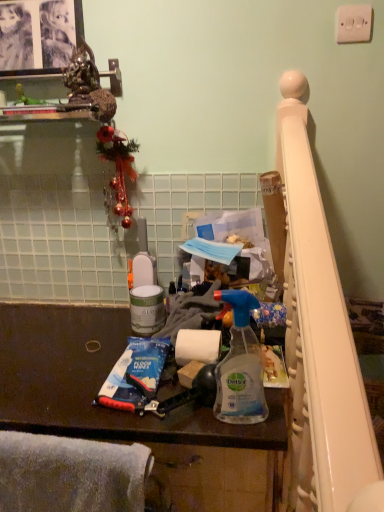
Question: Is white glossy paint can at center thinner than dark brown laminate counter at center?

Choices:
 (A) no
 (B) yes

Answer: (B)

Question: Is white glossy paint can at center not close to dark brown laminate counter at center?

Choices:
 (A) yes
 (B) no

Answer: (B)

Question: Does white glossy paint can at center have a greater height compared to dark brown laminate counter at center?

Choices:
 (A) yes
 (B) no

Answer: (B)

Question: Is white glossy paint can at center behind dark brown laminate counter at center?

Choices:
 (A) yes
 (B) no

Answer: (A)

Question: Considering the relative positions of white glossy paint can at center and dark brown laminate counter at center in the image provided, is white glossy paint can at center to the left of dark brown laminate counter at center from the viewer's perspective?

Choices:
 (A) no
 (B) yes

Answer: (A)

Question: Is white glossy paint can at center in contact with dark brown laminate counter at center?

Choices:
 (A) no
 (B) yes

Answer: (A)

Question: Can you confirm if white soft towel at lower left is positioned to the right of transparent plastic spray bottle at center?

Choices:
 (A) yes
 (B) no

Answer: (B)

Question: Is white soft towel at lower left shorter than transparent plastic spray bottle at center?

Choices:
 (A) yes
 (B) no

Answer: (A)

Question: Is white soft towel at lower left smaller than transparent plastic spray bottle at center?

Choices:
 (A) yes
 (B) no

Answer: (B)

Question: Considering the relative sizes of white soft towel at lower left and transparent plastic spray bottle at center in the image provided, is white soft towel at lower left thinner than transparent plastic spray bottle at center?

Choices:
 (A) no
 (B) yes

Answer: (A)

Question: Does white soft towel at lower left appear on the left side of transparent plastic spray bottle at center?

Choices:
 (A) no
 (B) yes

Answer: (B)

Question: Is white soft towel at lower left closer to camera compared to transparent plastic spray bottle at center?

Choices:
 (A) no
 (B) yes

Answer: (B)

Question: From a real-world perspective, is dark brown laminate counter at center located beneath white plastic light switch at upper right?

Choices:
 (A) no
 (B) yes

Answer: (B)